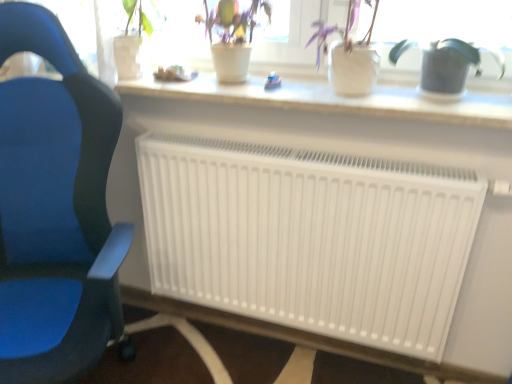
Question: Considering the relative sizes of green matte plant at upper center, which is the 1th houseplant from left to right, and white matte pot at upper center, which appears as the second houseplant when viewed from the left, in the image provided, is green matte plant at upper center, which is the 1th houseplant from left to right, smaller than white matte pot at upper center, which appears as the second houseplant when viewed from the left,?

Choices:
 (A) no
 (B) yes

Answer: (B)

Question: From a real-world perspective, is green matte plant at upper center, the 3th houseplant from the right, on top of white matte pot at upper center, which appears as the second houseplant when viewed from the left?

Choices:
 (A) no
 (B) yes

Answer: (A)

Question: Could you tell me if green matte plant at upper center, the 3th houseplant from the right, is turned towards white matte pot at upper center, which appears as the second houseplant when viewed from the left?

Choices:
 (A) yes
 (B) no

Answer: (B)

Question: Can you confirm if green matte plant at upper center, which is the 1th houseplant from left to right, is thinner than white matte pot at upper center, the second houseplant viewed from the right?

Choices:
 (A) no
 (B) yes

Answer: (B)

Question: Is green matte plant at upper center, the 3th houseplant from the right, outside white matte pot at upper center, the second houseplant viewed from the right?

Choices:
 (A) yes
 (B) no

Answer: (A)

Question: Do you think green matte watering can at right, which is the third houseplant in left-to-right order, is within green matte plant at upper center, which is the 1th houseplant from left to right, or outside of it?

Choices:
 (A) outside
 (B) inside

Answer: (A)

Question: Is green matte watering can at right, which is the third houseplant in left-to-right order, wider or thinner than green matte plant at upper center, which is the 1th houseplant from left to right?

Choices:
 (A) thin
 (B) wide

Answer: (A)

Question: Relative to green matte plant at upper center, which is the 1th houseplant from left to right, is green matte watering can at right, which is the third houseplant in left-to-right order, in front or behind?

Choices:
 (A) front
 (B) behind

Answer: (A)

Question: Visually, is green matte watering can at right, which is the 1th houseplant in right-to-left order, positioned to the left or to the right of green matte plant at upper center, which is the 1th houseplant from left to right?

Choices:
 (A) left
 (B) right

Answer: (B)

Question: From the image's perspective, is green matte plant at upper center, which is the 1th houseplant from left to right, above or below white matte radiator at center?

Choices:
 (A) above
 (B) below

Answer: (A)

Question: Considering the positions of green matte plant at upper center, which is the 1th houseplant from left to right, and white matte radiator at center in the image, is green matte plant at upper center, which is the 1th houseplant from left to right, bigger or smaller than white matte radiator at center?

Choices:
 (A) small
 (B) big

Answer: (A)

Question: In terms of width, does green matte plant at upper center, which is the 1th houseplant from left to right, look wider or thinner when compared to white matte radiator at center?

Choices:
 (A) thin
 (B) wide

Answer: (B)

Question: Does point (221, 77) appear closer or farther from the camera than point (356, 253)?

Choices:
 (A) closer
 (B) farther

Answer: (B)

Question: In terms of width, does white matte radiator at center look wider or thinner when compared to green matte watering can at right, which is the 1th houseplant in right-to-left order?

Choices:
 (A) wide
 (B) thin

Answer: (B)

Question: From a real-world perspective, is white matte radiator at center above or below green matte watering can at right, which is the 1th houseplant in right-to-left order?

Choices:
 (A) above
 (B) below

Answer: (B)